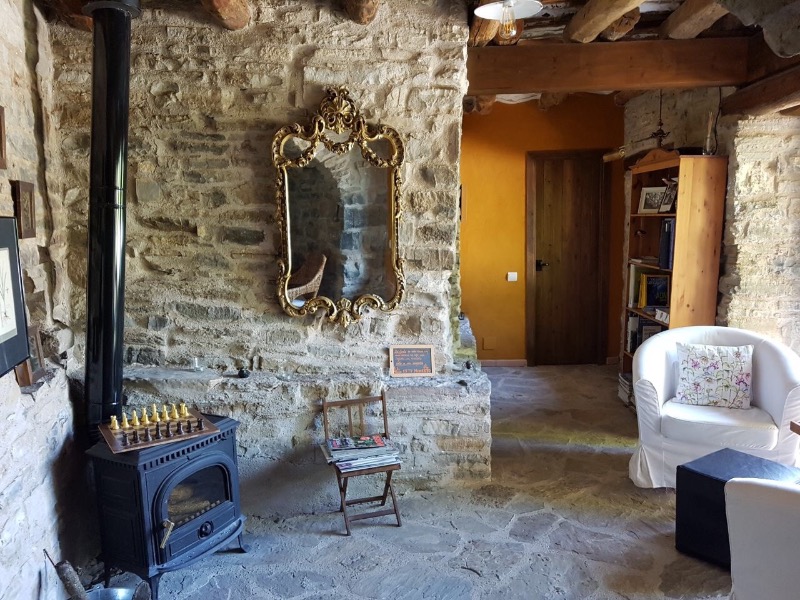
The image size is (800, 600). What are the coordinates of `reflection of an arched doorway` in the screenshot? It's located at (330, 225).